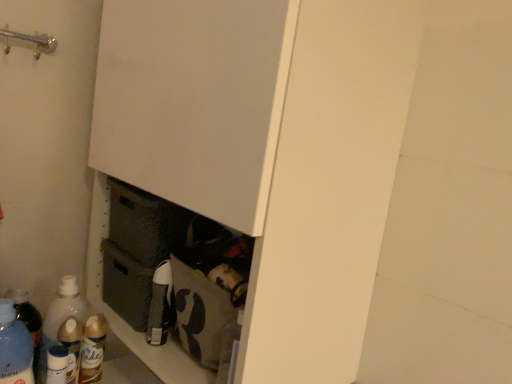
Find the location of a particular element. The height and width of the screenshot is (384, 512). white matte cupboard at center is located at coordinates (269, 150).

Measure the distance between point (105, 327) and camera.

The depth of point (105, 327) is 1.01 meters.

The width and height of the screenshot is (512, 384). I want to click on translucent plastic bottle at lower left, the fourth bottle positioned from the right, so click(x=71, y=346).

Measure the distance between translucent plastic bottle at lower left, which ranks as the 5th bottle in right-to-left order, and camera.

They are 81.53 centimeters apart.

Identify the location of matte black bottle at center, positioned as the first bottle in right-to-left order. This screenshot has width=512, height=384. (160, 305).

Between translucent plastic bottle at lower left, which ranks as the 5th bottle in right-to-left order, and translucent plastic bottle at lower left, the fourth bottle positioned from the right, which one has more height?

With more height is translucent plastic bottle at lower left, which ranks as the 5th bottle in right-to-left order.

Based on the photo, from the image's perspective, is translucent plastic bottle at lower left, positioned as the first bottle in left-to-right order, on translucent plastic bottle at lower left, positioned as the second bottle in left-to-right order?

Yes, from the image's perspective, translucent plastic bottle at lower left, positioned as the first bottle in left-to-right order, is over translucent plastic bottle at lower left, positioned as the second bottle in left-to-right order.

Which object is closer to the camera taking this photo, translucent plastic bottle at lower left, which ranks as the 5th bottle in right-to-left order, or translucent plastic bottle at lower left, the fourth bottle positioned from the right?

translucent plastic bottle at lower left, which ranks as the 5th bottle in right-to-left order.

Consider the image. Is translucent plastic bottle at lower left, which ranks as the 5th bottle in right-to-left order, looking in the opposite direction of translucent plastic bottle at lower left, positioned as the second bottle in left-to-right order?

No, translucent plastic bottle at lower left, which ranks as the 5th bottle in right-to-left order,'s orientation is not away from translucent plastic bottle at lower left, positioned as the second bottle in left-to-right order.

This screenshot has height=384, width=512. Identify the location of door handle above the white matte cupboard at center (from the image's perspective). (29, 41).

Can you confirm if brushed metal door handle at upper left is positioned to the right of white matte cupboard at center?

In fact, brushed metal door handle at upper left is to the left of white matte cupboard at center.

Is white matte cupboard at center at the back of brushed metal door handle at upper left?

No, white matte cupboard at center is not at the back of brushed metal door handle at upper left.

Is brushed metal door handle at upper left far away from white matte cupboard at center?

No.

Is translucent plastic bottle at lower left, positioned as the first bottle in left-to-right order, positioned with its back to white matte cupboard at center?

translucent plastic bottle at lower left, positioned as the first bottle in left-to-right order, is not turned away from white matte cupboard at center.

Considering the sizes of objects translucent plastic bottle at lower left, which ranks as the 5th bottle in right-to-left order, and white matte cupboard at center in the image provided, who is taller, translucent plastic bottle at lower left, which ranks as the 5th bottle in right-to-left order, or white matte cupboard at center?

With more height is white matte cupboard at center.

Which is in front, point (0, 313) or point (151, 77)?

The point (0, 313) is in front.

Would you say translucent plastic bottle at lower left, which ranks as the 5th bottle in right-to-left order, is inside or outside white matte cupboard at center?

translucent plastic bottle at lower left, which ranks as the 5th bottle in right-to-left order, lies outside white matte cupboard at center.

From a real-world perspective, which is physically below, matte black bottle at center, positioned as the first bottle in right-to-left order, or translucent plastic bottle at lower left, the 3th bottle when ordered from right to left?

From a 3D spatial view, translucent plastic bottle at lower left, the 3th bottle when ordered from right to left, is below.

From the image's perspective, is matte black bottle at center, positioned as the first bottle in right-to-left order, positioned above or below translucent plastic bottle at lower left, acting as the 3th bottle starting from the left?

From the image's perspective, matte black bottle at center, positioned as the first bottle in right-to-left order, appears above translucent plastic bottle at lower left, acting as the 3th bottle starting from the left.

Can you tell me how much matte black bottle at center, positioned as the first bottle in right-to-left order, and translucent plastic bottle at lower left, acting as the 3th bottle starting from the left, differ in facing direction?

The angular difference between matte black bottle at center, positioned as the first bottle in right-to-left order, and translucent plastic bottle at lower left, acting as the 3th bottle starting from the left, is 89.1 degrees.

Considering the relative sizes of matte black bottle at center, positioned as the first bottle in right-to-left order, and translucent plastic bottle at lower left, acting as the 3th bottle starting from the left, in the image provided, is matte black bottle at center, positioned as the first bottle in right-to-left order, thinner than translucent plastic bottle at lower left, acting as the 3th bottle starting from the left,?

Indeed, matte black bottle at center, positioned as the first bottle in right-to-left order, has a lesser width compared to translucent plastic bottle at lower left, acting as the 3th bottle starting from the left.

Considering the points (278, 358) and (178, 361), which point is behind, point (278, 358) or point (178, 361)?

Point (178, 361)

Considering their positions, is white matte cupboard at center located in front of or behind matte gray cabinet at center?

white matte cupboard at center is positioned closer to the viewer than matte gray cabinet at center.

You are a GUI agent. You are given a task and a screenshot of the screen. Output one action in this format:
    pyautogui.click(x=<x>, y=<y>)
    Task: Click on the cupboard in front of the matte gray cabinet at center
    
    Given the screenshot: What is the action you would take?
    pyautogui.click(x=269, y=150)

Considering the sizes of translucent plastic bottle at lower left, acting as the 3th bottle starting from the left, and brushed metal door handle at upper left in the image, is translucent plastic bottle at lower left, acting as the 3th bottle starting from the left, taller or shorter than brushed metal door handle at upper left?

Clearly, translucent plastic bottle at lower left, acting as the 3th bottle starting from the left, is taller compared to brushed metal door handle at upper left.

Is translucent plastic bottle at lower left, acting as the 3th bottle starting from the left, further to the viewer compared to brushed metal door handle at upper left?

Yes.

Is translucent plastic bottle at lower left, acting as the 3th bottle starting from the left, inside the boundaries of brushed metal door handle at upper left, or outside?

translucent plastic bottle at lower left, acting as the 3th bottle starting from the left, is not enclosed by brushed metal door handle at upper left.

Which is more to the left, translucent plastic bottle at lower left, the fourth bottle positioned from the right, or translucent plastic bottle at lower left, the 3th bottle when ordered from right to left?

Positioned to the left is translucent plastic bottle at lower left, the fourth bottle positioned from the right.

Is translucent plastic bottle at lower left, the fourth bottle positioned from the right, oriented away from translucent plastic bottle at lower left, the 3th bottle when ordered from right to left?

No.

Which of these two, translucent plastic bottle at lower left, the fourth bottle positioned from the right, or translucent plastic bottle at lower left, the 3th bottle when ordered from right to left, is thinner?

translucent plastic bottle at lower left, the 3th bottle when ordered from right to left, is thinner.

Do you think translucent plastic bottle at lower left, the fourth bottle positioned from the right, is within translucent plastic bottle at lower left, the 3th bottle when ordered from right to left, or outside of it?

translucent plastic bottle at lower left, the fourth bottle positioned from the right, lies outside translucent plastic bottle at lower left, the 3th bottle when ordered from right to left.

The image size is (512, 384). Find the location of `the 1st bottle above when counting from the translucent plastic bottle at lower left, the fourth bottle positioned from the right (from the image's perspective)`. the 1st bottle above when counting from the translucent plastic bottle at lower left, the fourth bottle positioned from the right (from the image's perspective) is located at coordinates tap(14, 347).

This screenshot has width=512, height=384. Identify the location of cupboard below the brushed metal door handle at upper left (from the image's perspective). (269, 150).

Based on their spatial positions, is translucent plastic bottle at lower left, which ranks as the 5th bottle in right-to-left order, or matte gray cabinet at center further from translucent plastic spray can at lower left, positioned as the 2th bottle in right-to-left order?

Among the two, matte gray cabinet at center is located further to translucent plastic spray can at lower left, positioned as the 2th bottle in right-to-left order.

Based on their spatial positions, is translucent plastic bottle at lower left, positioned as the second bottle in left-to-right order, or translucent plastic bottle at lower left, which ranks as the 5th bottle in right-to-left order, closer to brushed metal door handle at upper left?

The object closer to brushed metal door handle at upper left is translucent plastic bottle at lower left, which ranks as the 5th bottle in right-to-left order.

Based on their spatial positions, is brushed metal door handle at upper left or white matte cupboard at center closer to translucent plastic spray can at lower left, positioned as the 2th bottle in right-to-left order?

white matte cupboard at center is positioned closer to the anchor translucent plastic spray can at lower left, positioned as the 2th bottle in right-to-left order.

Based on their spatial positions, is translucent plastic bottle at lower left, the 3th bottle when ordered from right to left, or translucent plastic bottle at lower left, positioned as the second bottle in left-to-right order, further from translucent plastic bottle at lower left, positioned as the first bottle in left-to-right order?

The object further to translucent plastic bottle at lower left, positioned as the first bottle in left-to-right order, is translucent plastic bottle at lower left, positioned as the second bottle in left-to-right order.

Which object lies further to the anchor point translucent plastic bottle at lower left, positioned as the first bottle in left-to-right order, matte black bottle at center, the 5th bottle from the left, or brushed metal door handle at upper left?

brushed metal door handle at upper left.

Estimate the real-world distances between objects in this image. Which object is closer to matte gray cabinet at center, translucent plastic spray can at lower left, the 4th bottle when ordered from left to right, or white matte cupboard at center?

The object closer to matte gray cabinet at center is translucent plastic spray can at lower left, the 4th bottle when ordered from left to right.

Which object lies further to the anchor point matte gray cabinet at center, white matte cupboard at center or translucent plastic bottle at lower left, the 3th bottle when ordered from right to left?

The object further to matte gray cabinet at center is white matte cupboard at center.

Looking at the image, which one is located further to matte gray cabinet at center, matte black bottle at center, positioned as the first bottle in right-to-left order, or translucent plastic spray can at lower left, positioned as the 2th bottle in right-to-left order?

Based on the image, matte black bottle at center, positioned as the first bottle in right-to-left order, appears to be further to matte gray cabinet at center.

You are a GUI agent. You are given a task and a screenshot of the screen. Output one action in this format:
    pyautogui.click(x=<x>, y=<y>)
    Task: Click on the cabinetry between white matte cupboard at center and translucent plastic bottle at lower left, the fourth bottle positioned from the right, vertically
    The image size is (512, 384).
    Given the screenshot: What is the action you would take?
    pyautogui.click(x=120, y=317)

Where is `cabinetry between white matte cupboard at center and translucent plastic bottle at lower left, acting as the 3th bottle starting from the left, from top to bottom`? This screenshot has width=512, height=384. cabinetry between white matte cupboard at center and translucent plastic bottle at lower left, acting as the 3th bottle starting from the left, from top to bottom is located at coordinates (120, 317).

Where is `cupboard between brushed metal door handle at upper left and translucent plastic bottle at lower left, acting as the 3th bottle starting from the left, from top to bottom`? The height and width of the screenshot is (384, 512). cupboard between brushed metal door handle at upper left and translucent plastic bottle at lower left, acting as the 3th bottle starting from the left, from top to bottom is located at coordinates (269, 150).

Find the location of a particular element. Image resolution: width=512 pixels, height=384 pixels. bottle positioned between translucent plastic bottle at lower left, acting as the 3th bottle starting from the left, and translucent plastic spray can at lower left, positioned as the 2th bottle in right-to-left order, from near to far is located at coordinates (71, 346).